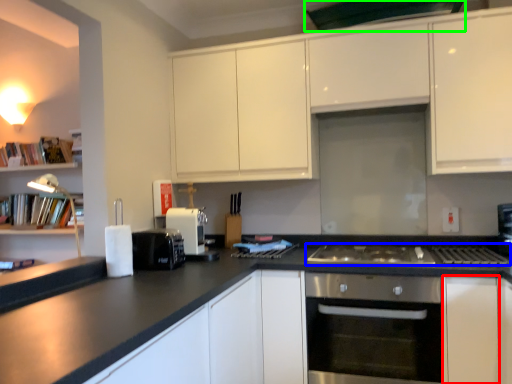
Question: Estimate the real-world distances between objects in this image. Which object is closer to cabinetry (highlighted by a red box), gas stove (highlighted by a blue box) or exhaust hood (highlighted by a green box)?

Choices:
 (A) gas stove
 (B) exhaust hood

Answer: (A)